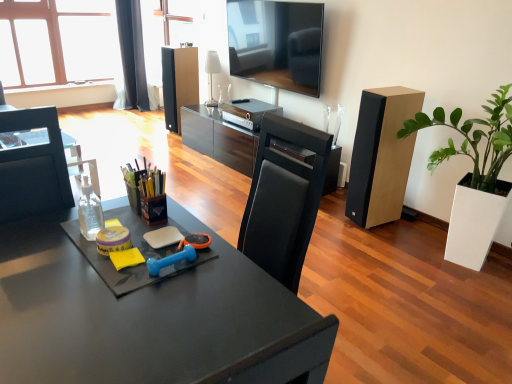
This screenshot has width=512, height=384. What are the coordinates of `vacant region to the left of clear plastic bottle at left` in the screenshot? It's located at (55, 235).